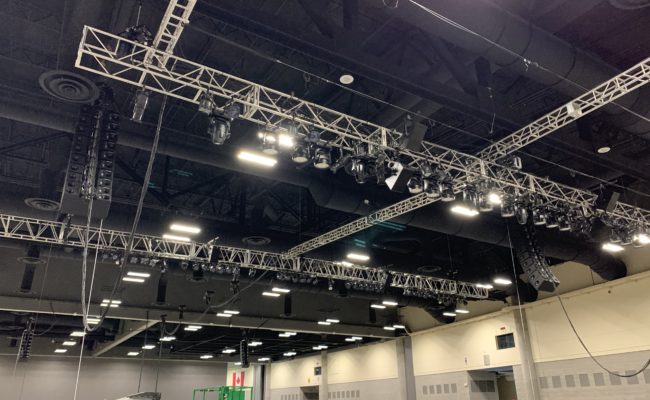
Where is `door`? door is located at coordinates (306, 388), (494, 376).